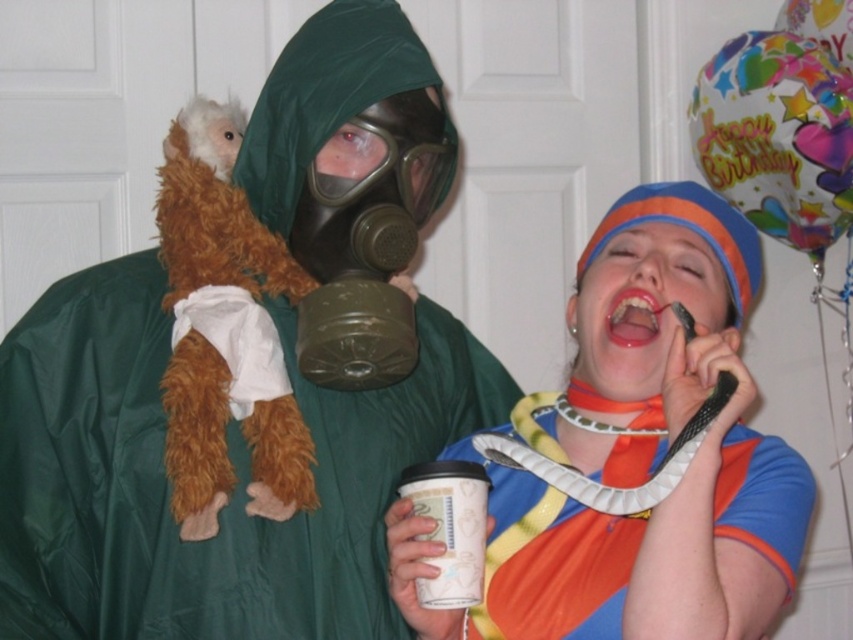
Question: Does green matte raincoat at left appear over white paper cup at lower center?

Choices:
 (A) no
 (B) yes

Answer: (B)

Question: Estimate the real-world distances between objects in this image. Which object is closer to the matte plastic snake at right?

Choices:
 (A) colorful paper balloon at upper right
 (B) white paper cup at lower center
 (C) green matte raincoat at left

Answer: (B)

Question: Does green matte raincoat at left have a larger size compared to matte plastic snake at right?

Choices:
 (A) no
 (B) yes

Answer: (B)

Question: Does colorful paper balloon at upper right have a smaller size compared to white paper cup at lower center?

Choices:
 (A) no
 (B) yes

Answer: (A)

Question: Which of the following is the farthest from the observer?

Choices:
 (A) colorful paper balloon at upper right
 (B) green matte raincoat at left
 (C) matte plastic snake at right

Answer: (A)

Question: Which of these objects is positioned closest to the green matte raincoat at left?

Choices:
 (A) colorful paper balloon at upper right
 (B) white paper cup at lower center
 (C) matte plastic snake at right

Answer: (C)